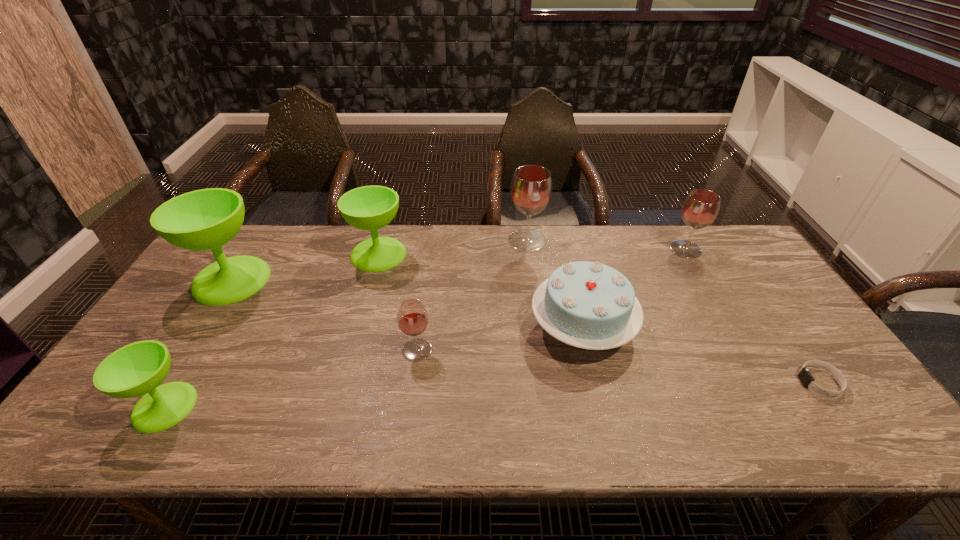
Identify the location of vacant area at the far edge. click(x=480, y=247).

Locate an element on the screen. free space at the near edge is located at coordinates (550, 431).

Locate an element on the screen. Image resolution: width=960 pixels, height=540 pixels. free point at the left edge is located at coordinates (153, 340).

In the image, there is a desktop. Where is `vacant area at the right edge`? vacant area at the right edge is located at coordinates (837, 385).

In the image, there is a desktop. Where is `vacant space at the far left corner`? The height and width of the screenshot is (540, 960). vacant space at the far left corner is located at coordinates (247, 227).

Locate an element on the screen. The height and width of the screenshot is (540, 960). blank space at the near right corner is located at coordinates (866, 415).

The image size is (960, 540). I want to click on vacant space that is in between the wristband and the nearest wineglass, so click(x=492, y=394).

The height and width of the screenshot is (540, 960). Identify the location of blank region between the rightmost wineglass and the blue birthday cake. click(634, 288).

Locate an element on the screen. Image resolution: width=960 pixels, height=540 pixels. free area in between the second object from right to left and the biggest green wineglass is located at coordinates pyautogui.click(x=458, y=265).

Find the location of a particular element. The width and height of the screenshot is (960, 540). vacant space that's between the second biggest green wineglass and the biggest green wineglass is located at coordinates (305, 267).